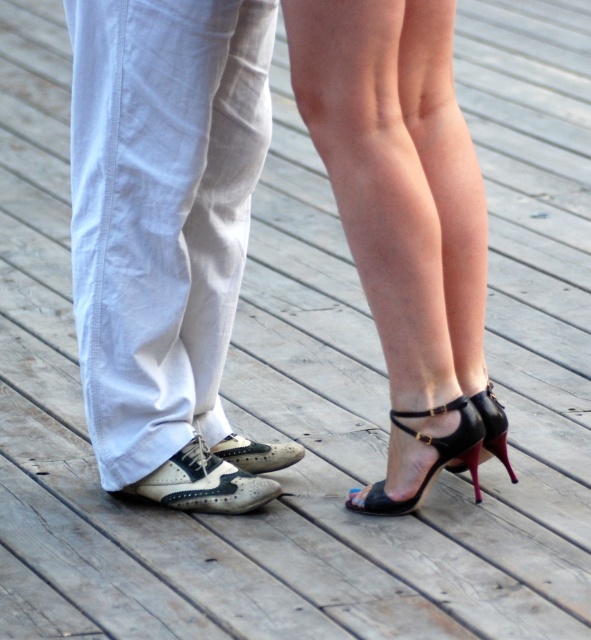
Is point (463, 173) positioned behind point (174, 470)?

No, it is in front of (174, 470).

Is point (434, 84) in front of point (223, 486)?

Yes, point (434, 84) is closer to viewer.

Which is behind, point (459, 467) or point (212, 504)?

The point (459, 467) is behind.

This screenshot has height=640, width=591. What are the coordinates of `black leather high heels at center` in the screenshot? It's located at coord(452,202).

Between point (238, 448) and point (151, 484), which one is positioned behind?

The point (238, 448) is behind.

Identify the location of white linen pants at center. Image resolution: width=591 pixels, height=640 pixels. (228, 230).

Does black patent leather high heels at center appear on the left side of leather brogue shoe at center?

In fact, black patent leather high heels at center is to the right of leather brogue shoe at center.

Does black patent leather high heels at center have a lesser width compared to leather brogue shoe at center?

No.

Is point (404, 0) farther from viewer compared to point (254, 444)?

No, (404, 0) is closer to viewer.

The height and width of the screenshot is (640, 591). Find the location of `black patent leather high heels at center`. black patent leather high heels at center is located at coordinates (402, 216).